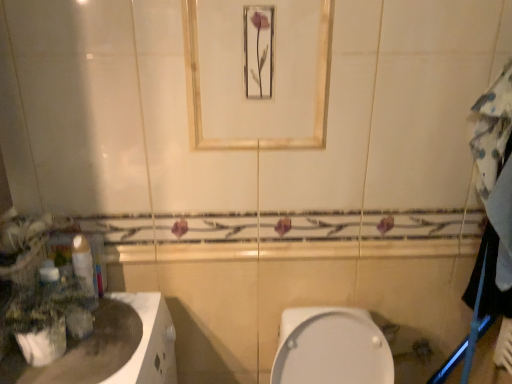
Question: In terms of height, does white glossy toilet paper at left look taller or shorter compared to green matte plant at left?

Choices:
 (A) short
 (B) tall

Answer: (B)

Question: Considering the positions of white glossy toilet paper at left and green matte plant at left in the image, is white glossy toilet paper at left wider or thinner than green matte plant at left?

Choices:
 (A) wide
 (B) thin

Answer: (B)

Question: Estimate the real-world distances between objects in this image. Which object is farther from the white glossy toilet paper at left?

Choices:
 (A) green matte plant at left
 (B) white glossy countertop at lower left
 (C) matte gold mirror at upper center

Answer: (C)

Question: Which is nearer to the green matte plant at left?

Choices:
 (A) white glossy countertop at lower left
 (B) matte gold mirror at upper center
 (C) white glossy toilet paper at left

Answer: (C)